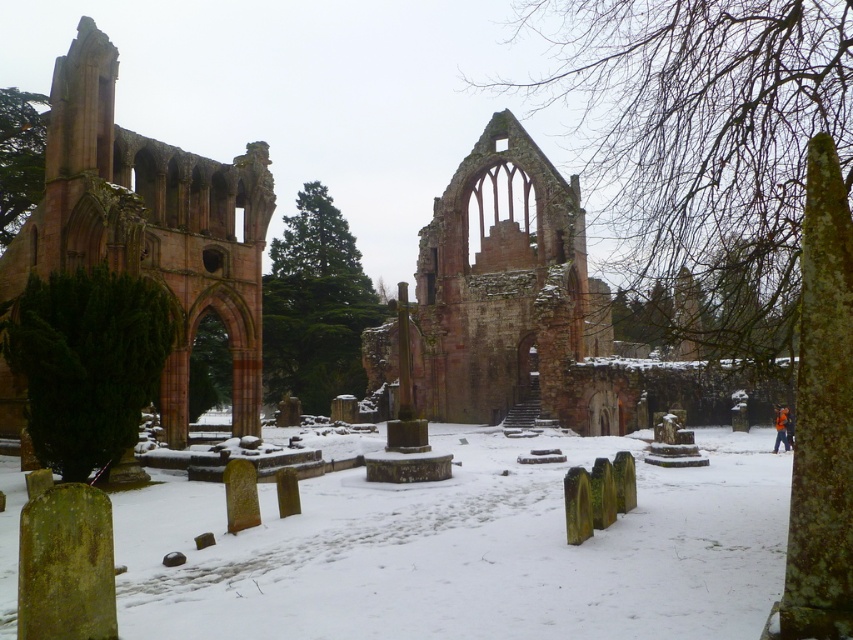
Between point (53, 138) and point (486, 227), which one is positioned behind?

Positioned behind is point (486, 227).

Between point (245, 404) and point (486, 371), which one is positioned in front?

Point (245, 404) is in front.

Is point (213, 304) positioned before point (474, 378)?

Yes, point (213, 304) is in front of point (474, 378).

Where is `rustic stone arch at left`? Image resolution: width=853 pixels, height=640 pixels. rustic stone arch at left is located at coordinates (149, 225).